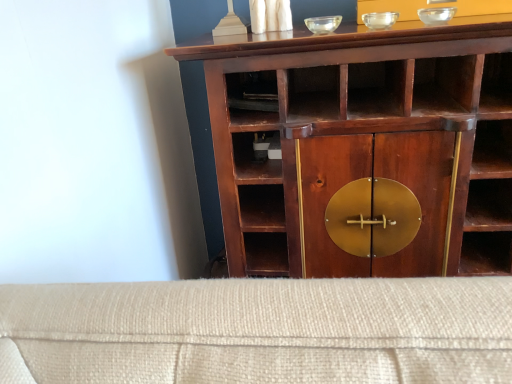
Describe the element at coordinates (436, 15) in the screenshot. I see `transparent glass bowl at upper right, the 1th glass bowl when ordered from right to left` at that location.

From the picture: Measure the distance between transparent glass bowl at upper center, marked as the first glass bowl in a left-to-right arrangement, and camera.

A distance of 32.57 inches exists between transparent glass bowl at upper center, marked as the first glass bowl in a left-to-right arrangement, and camera.

Identify the location of transparent glass bowl at upper center, acting as the second glass bowl starting from the left. (380, 20).

Considering the positions of objects transparent glass bowl at upper center, marked as the first glass bowl in a left-to-right arrangement, and mahogany wood cupboard at center in the image provided, who is behind, transparent glass bowl at upper center, marked as the first glass bowl in a left-to-right arrangement, or mahogany wood cupboard at center?

transparent glass bowl at upper center, marked as the first glass bowl in a left-to-right arrangement, is more distant.

Does point (335, 19) lie behind point (262, 192)?

No, it is not.

Find the location of a particular element. The width and height of the screenshot is (512, 384). cupboard on the right of transparent glass bowl at upper center, marked as the first glass bowl in a left-to-right arrangement is located at coordinates (351, 120).

Would you consider transparent glass bowl at upper center, marked as the first glass bowl in a left-to-right arrangement, to be distant from mahogany wood cupboard at center?

transparent glass bowl at upper center, marked as the first glass bowl in a left-to-right arrangement, is near mahogany wood cupboard at center, not far away.

Considering the positions of objects transparent glass bowl at upper right, the 1th glass bowl when ordered from right to left, and transparent glass bowl at upper center, acting as the second glass bowl starting from the left, in the image provided, who is behind, transparent glass bowl at upper right, the 1th glass bowl when ordered from right to left, or transparent glass bowl at upper center, acting as the second glass bowl starting from the left,?

transparent glass bowl at upper center, acting as the second glass bowl starting from the left, is further away from the camera.

Between transparent glass bowl at upper right, positioned as the 3th glass bowl in left-to-right order, and transparent glass bowl at upper center, acting as the second glass bowl starting from the left, which one has less height?

With less height is transparent glass bowl at upper right, positioned as the 3th glass bowl in left-to-right order.

Consider the image. Would you say transparent glass bowl at upper right, positioned as the 3th glass bowl in left-to-right order, is to the left or to the right of transparent glass bowl at upper center, acting as the second glass bowl starting from the left, in the picture?

transparent glass bowl at upper right, positioned as the 3th glass bowl in left-to-right order, is to the right of transparent glass bowl at upper center, acting as the second glass bowl starting from the left.

Which is more distant, (448, 15) or (500, 168)?

Point (500, 168)

Locate an element on the screen. the 2nd glass bowl above the mahogany wood cupboard at center (from a real-world perspective) is located at coordinates (436, 15).

From a real-world perspective, is transparent glass bowl at upper right, positioned as the 3th glass bowl in left-to-right order, located higher than mahogany wood cupboard at center?

Yes.

Between transparent glass bowl at upper right, positioned as the 3th glass bowl in left-to-right order, and mahogany wood cupboard at center, which one has less height?

With less height is transparent glass bowl at upper right, positioned as the 3th glass bowl in left-to-right order.

In terms of height, does transparent glass bowl at upper center, acting as the 3th glass bowl starting from the right, look taller or shorter compared to transparent glass bowl at upper center, acting as the second glass bowl starting from the left?

Clearly, transparent glass bowl at upper center, acting as the 3th glass bowl starting from the right, is shorter compared to transparent glass bowl at upper center, acting as the second glass bowl starting from the left.

Which of these two, transparent glass bowl at upper center, marked as the first glass bowl in a left-to-right arrangement, or transparent glass bowl at upper center, acting as the second glass bowl starting from the left, is thinner?

transparent glass bowl at upper center, marked as the first glass bowl in a left-to-right arrangement, is thinner.

From the image's perspective, which is below, transparent glass bowl at upper center, acting as the 3th glass bowl starting from the right, or transparent glass bowl at upper center, acting as the second glass bowl starting from the left?

transparent glass bowl at upper center, acting as the 3th glass bowl starting from the right, appears lower in the image.

Where is `the 1st glass bowl to the right of the transparent glass bowl at upper center, acting as the 3th glass bowl starting from the right, counting from the anchor's position`? Image resolution: width=512 pixels, height=384 pixels. the 1st glass bowl to the right of the transparent glass bowl at upper center, acting as the 3th glass bowl starting from the right, counting from the anchor's position is located at coordinates (380, 20).

Is transparent glass bowl at upper center, acting as the second glass bowl starting from the left, completely or partially outside of transparent glass bowl at upper center, acting as the 3th glass bowl starting from the right?

Absolutely, transparent glass bowl at upper center, acting as the second glass bowl starting from the left, is external to transparent glass bowl at upper center, acting as the 3th glass bowl starting from the right.

Is transparent glass bowl at upper center, positioned as the 2th glass bowl in right-to-left order, taller or shorter than transparent glass bowl at upper center, marked as the first glass bowl in a left-to-right arrangement?

Clearly, transparent glass bowl at upper center, positioned as the 2th glass bowl in right-to-left order, is taller compared to transparent glass bowl at upper center, marked as the first glass bowl in a left-to-right arrangement.

I want to click on the 1st glass bowl in front when counting from the transparent glass bowl at upper center, marked as the first glass bowl in a left-to-right arrangement, so click(x=380, y=20).

Consider the image. Can you confirm if transparent glass bowl at upper right, the 1th glass bowl when ordered from right to left, is smaller than transparent glass bowl at upper center, marked as the first glass bowl in a left-to-right arrangement?

No, transparent glass bowl at upper right, the 1th glass bowl when ordered from right to left, is not smaller than transparent glass bowl at upper center, marked as the first glass bowl in a left-to-right arrangement.

Where is `the 2nd glass bowl counting from the right side of the transparent glass bowl at upper center, acting as the 3th glass bowl starting from the right`? the 2nd glass bowl counting from the right side of the transparent glass bowl at upper center, acting as the 3th glass bowl starting from the right is located at coordinates (436, 15).

Is the position of transparent glass bowl at upper right, positioned as the 3th glass bowl in left-to-right order, less distant than that of transparent glass bowl at upper center, marked as the first glass bowl in a left-to-right arrangement?

Yes, transparent glass bowl at upper right, positioned as the 3th glass bowl in left-to-right order, is closer to the camera.

Which is more to the right, transparent glass bowl at upper right, positioned as the 3th glass bowl in left-to-right order, or transparent glass bowl at upper center, marked as the first glass bowl in a left-to-right arrangement?

Positioned to the right is transparent glass bowl at upper right, positioned as the 3th glass bowl in left-to-right order.

From a real-world perspective, who is located lower, mahogany wood cupboard at center or transparent glass bowl at upper right, positioned as the 3th glass bowl in left-to-right order?

From a 3D spatial view, mahogany wood cupboard at center is below.

From the image's perspective, is mahogany wood cupboard at center located above or below transparent glass bowl at upper right, the 1th glass bowl when ordered from right to left?

Clearly, from the image's perspective, mahogany wood cupboard at center is below transparent glass bowl at upper right, the 1th glass bowl when ordered from right to left.

Considering the sizes of objects mahogany wood cupboard at center and transparent glass bowl at upper right, the 1th glass bowl when ordered from right to left, in the image provided, who is wider, mahogany wood cupboard at center or transparent glass bowl at upper right, the 1th glass bowl when ordered from right to left,?

mahogany wood cupboard at center is wider.

You are a GUI agent. You are given a task and a screenshot of the screen. Output one action in this format:
    pyautogui.click(x=<x>, y=<y>)
    Task: Click on the 2nd glass bowl above the mahogany wood cupboard at center (from a real-world perspective)
    The width and height of the screenshot is (512, 384).
    Given the screenshot: What is the action you would take?
    pyautogui.click(x=436, y=15)

From the image's perspective, which glass bowl is the 1st one above the mahogany wood cupboard at center? Please provide its 2D coordinates.

[(323, 24)]

Find the location of a particular element. glass bowl located above the transparent glass bowl at upper right, positioned as the 3th glass bowl in left-to-right order (from a real-world perspective) is located at coordinates (380, 20).

Looking at the image, which one is located further to transparent glass bowl at upper center, acting as the second glass bowl starting from the left, transparent glass bowl at upper center, marked as the first glass bowl in a left-to-right arrangement, or mahogany wood cupboard at center?

Based on the image, mahogany wood cupboard at center appears to be further to transparent glass bowl at upper center, acting as the second glass bowl starting from the left.

From the image, which object appears to be nearer to transparent glass bowl at upper right, the 1th glass bowl when ordered from right to left, transparent glass bowl at upper center, positioned as the 2th glass bowl in right-to-left order, or mahogany wood cupboard at center?

transparent glass bowl at upper center, positioned as the 2th glass bowl in right-to-left order, lies closer to transparent glass bowl at upper right, the 1th glass bowl when ordered from right to left, than the other object.

Looking at this image, looking at the image, which one is located closer to transparent glass bowl at upper center, marked as the first glass bowl in a left-to-right arrangement, transparent glass bowl at upper right, the 1th glass bowl when ordered from right to left, or mahogany wood cupboard at center?

transparent glass bowl at upper right, the 1th glass bowl when ordered from right to left.

Looking at the image, which one is located closer to transparent glass bowl at upper center, acting as the 3th glass bowl starting from the right, mahogany wood cupboard at center or transparent glass bowl at upper center, positioned as the 2th glass bowl in right-to-left order?

Based on the image, transparent glass bowl at upper center, positioned as the 2th glass bowl in right-to-left order, appears to be nearer to transparent glass bowl at upper center, acting as the 3th glass bowl starting from the right.

From the image, which object appears to be farther from transparent glass bowl at upper center, marked as the first glass bowl in a left-to-right arrangement, transparent glass bowl at upper center, acting as the second glass bowl starting from the left, or transparent glass bowl at upper right, positioned as the 3th glass bowl in left-to-right order?

transparent glass bowl at upper right, positioned as the 3th glass bowl in left-to-right order, lies further to transparent glass bowl at upper center, marked as the first glass bowl in a left-to-right arrangement, than the other object.

Considering their positions, is transparent glass bowl at upper center, acting as the 3th glass bowl starting from the right, positioned further to transparent glass bowl at upper center, positioned as the 2th glass bowl in right-to-left order, than transparent glass bowl at upper right, positioned as the 3th glass bowl in left-to-right order?

transparent glass bowl at upper center, acting as the 3th glass bowl starting from the right.

From the picture: Considering their positions, is transparent glass bowl at upper center, marked as the first glass bowl in a left-to-right arrangement, positioned further to transparent glass bowl at upper right, positioned as the 3th glass bowl in left-to-right order, than mahogany wood cupboard at center?

Based on the image, mahogany wood cupboard at center appears to be further to transparent glass bowl at upper right, positioned as the 3th glass bowl in left-to-right order.

Looking at the image, which one is located further to mahogany wood cupboard at center, transparent glass bowl at upper center, acting as the second glass bowl starting from the left, or transparent glass bowl at upper center, acting as the 3th glass bowl starting from the right?

transparent glass bowl at upper center, acting as the second glass bowl starting from the left.

Locate an element on the screen. The image size is (512, 384). glass bowl between transparent glass bowl at upper center, positioned as the 2th glass bowl in right-to-left order, and mahogany wood cupboard at center vertically is located at coordinates (323, 24).

Where is `glass bowl situated between transparent glass bowl at upper center, marked as the first glass bowl in a left-to-right arrangement, and transparent glass bowl at upper right, positioned as the 3th glass bowl in left-to-right order, from left to right`? glass bowl situated between transparent glass bowl at upper center, marked as the first glass bowl in a left-to-right arrangement, and transparent glass bowl at upper right, positioned as the 3th glass bowl in left-to-right order, from left to right is located at coordinates (380, 20).